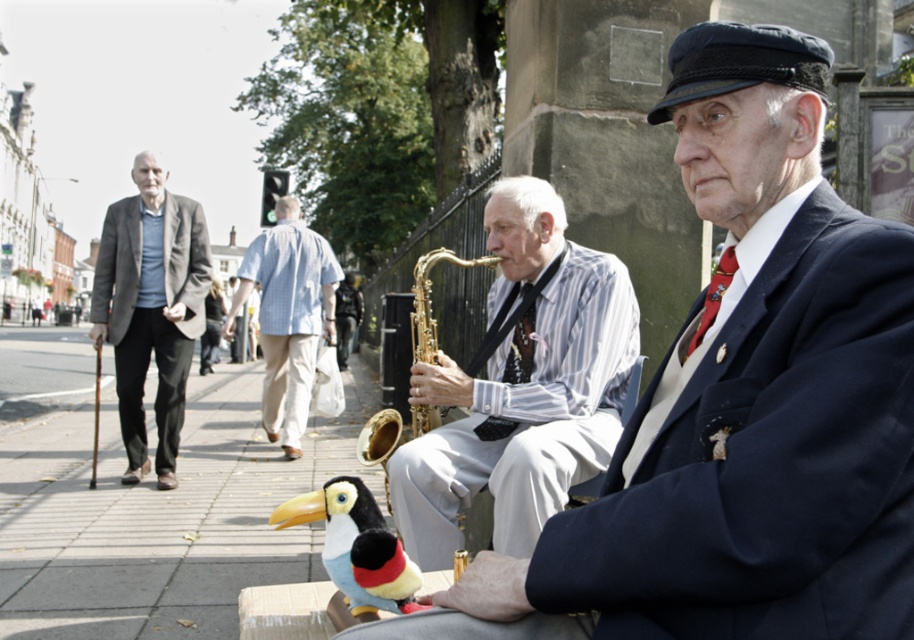
Question: Which object is the closest to the matte gray suit at left?

Choices:
 (A) soft beige pavement at lower left
 (B) soft plush toy at lower center
 (C) light blue checkered shirt at center

Answer: (A)

Question: Is soft beige pavement at lower left wider than light blue checkered shirt at center?

Choices:
 (A) yes
 (B) no

Answer: (A)

Question: Among these objects, which one is farthest from the camera?

Choices:
 (A) gold brass saxophone at center
 (B) soft plush toy at lower center
 (C) soft beige pavement at lower left

Answer: (A)

Question: Which point is farther to the camera?

Choices:
 (A) (462, 614)
 (B) (360, 454)
 (C) (507, 301)
 (D) (243, 444)

Answer: (D)

Question: Does soft plush toy at lower center have a greater width compared to gold brass saxophone at center?

Choices:
 (A) yes
 (B) no

Answer: (B)

Question: Is striped fabric tie at center bigger than wooden cane at left?

Choices:
 (A) no
 (B) yes

Answer: (A)